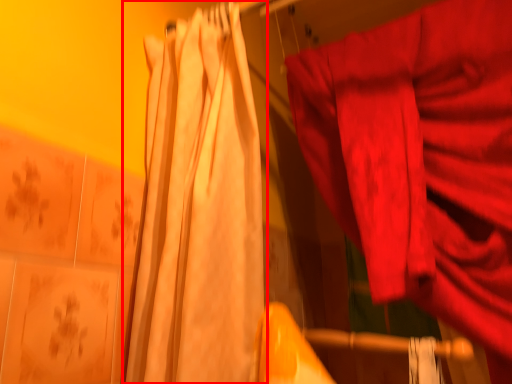
Question: From the image's perspective, what is the correct spatial relationship of curtain (annotated by the red box) in relation to curtain?

Choices:
 (A) below
 (B) above

Answer: (B)